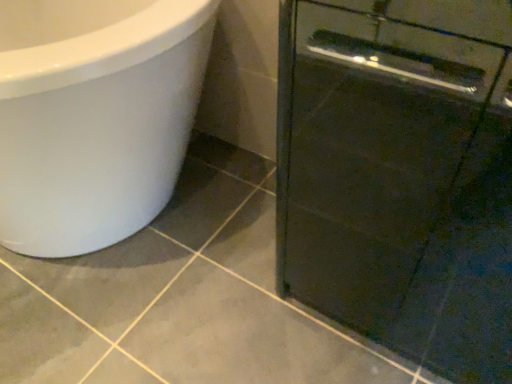
This screenshot has width=512, height=384. What are the coordinates of `black glossy cabinet at right` in the screenshot? It's located at (400, 176).

What do you see at coordinates (400, 176) in the screenshot?
I see `black glossy cabinet at right` at bounding box center [400, 176].

Find the location of `black glossy cabinet at right`. black glossy cabinet at right is located at coordinates (400, 176).